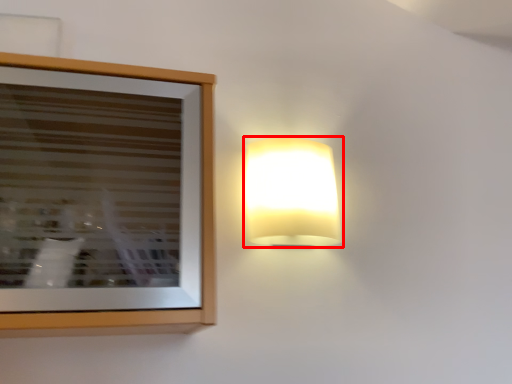
Question: From the image's perspective, what is the correct spatial relationship of lamp (annotated by the red box) in relation to picture frame?

Choices:
 (A) above
 (B) below

Answer: (A)